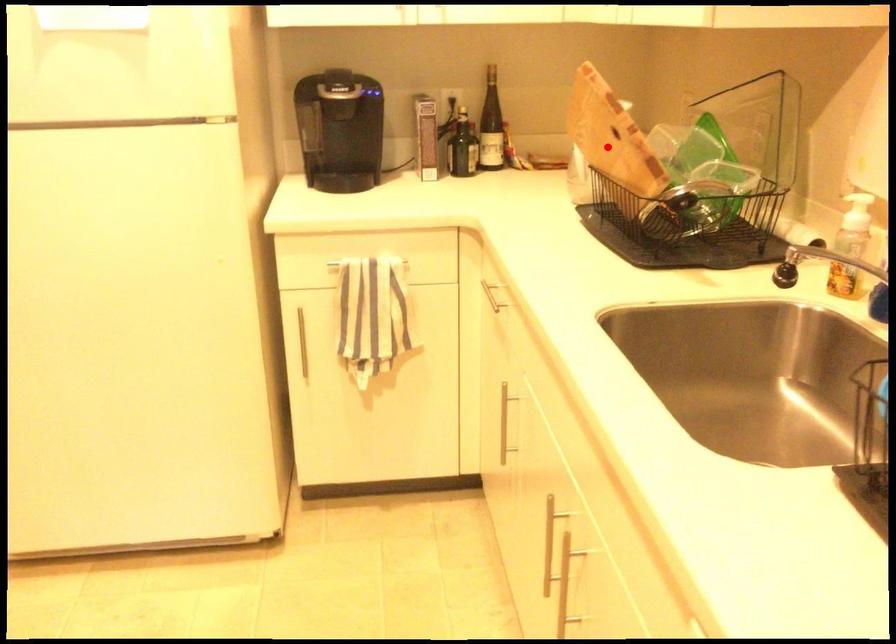
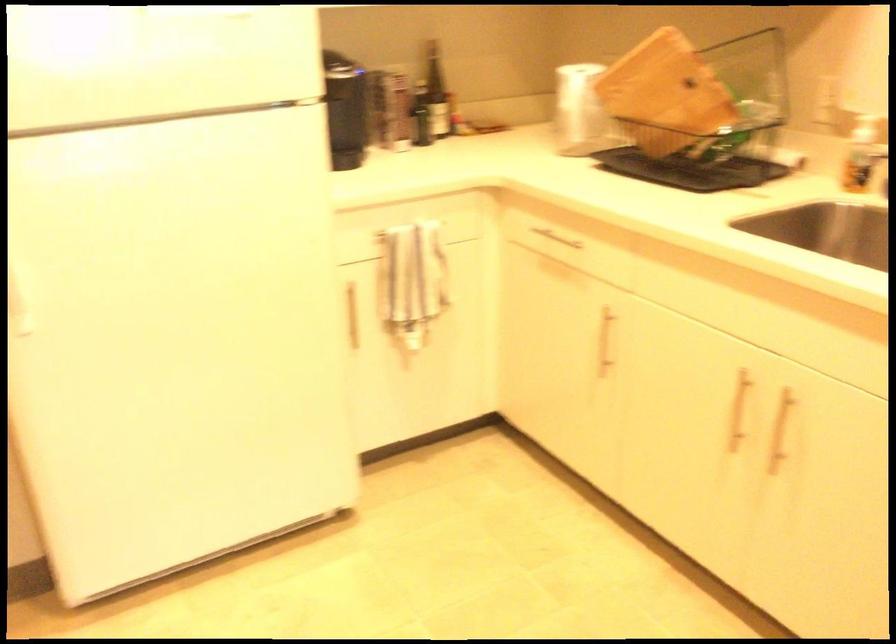
Find the pixel in the second image that matches the highlighted location in the first image.

(665, 93)